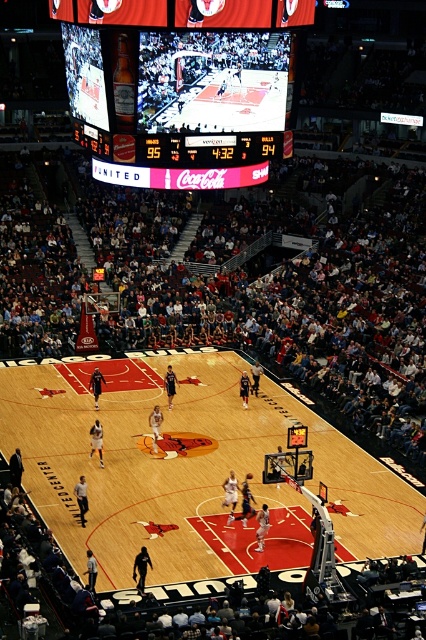
Could you measure the distance between wooden polished basketball court at center and shiny orange basketball at center?

7.84 meters

Between wooden polished basketball court at center and shiny orange basketball at center, which one has more height?

With more height is wooden polished basketball court at center.

Measure the distance between point (347, 548) and camera.

A distance of 27.87 meters exists between point (347, 548) and camera.

Where is `wooden polished basketball court at center`? This screenshot has height=640, width=426. wooden polished basketball court at center is located at coordinates (x=187, y=468).

Can you confirm if wooden polished basketball court at center is positioned below matte digital scoreboard at upper center?

Indeed, wooden polished basketball court at center is positioned under matte digital scoreboard at upper center.

Does wooden polished basketball court at center lie in front of matte digital scoreboard at upper center?

Yes, it is.

Does point (187, 419) lie behind point (226, 116)?

Yes, point (187, 419) is farther from viewer.

Identify the location of wooden polished basketball court at center. The height and width of the screenshot is (640, 426). (187, 468).

Is matte digital scoreboard at upper center above shiny orange basketball at center?

Yes, matte digital scoreboard at upper center is above shiny orange basketball at center.

Describe the element at coordinates (184, 97) in the screenshot. I see `matte digital scoreboard at upper center` at that location.

Which is in front, point (94, 86) or point (250, 476)?

Positioned in front is point (94, 86).

You are a GUI agent. You are given a task and a screenshot of the screen. Output one action in this format:
    pyautogui.click(x=<x>, y=<y>)
    Task: Click on the matte digital scoreboard at upper center
    The height and width of the screenshot is (640, 426).
    Given the screenshot: What is the action you would take?
    pyautogui.click(x=184, y=97)